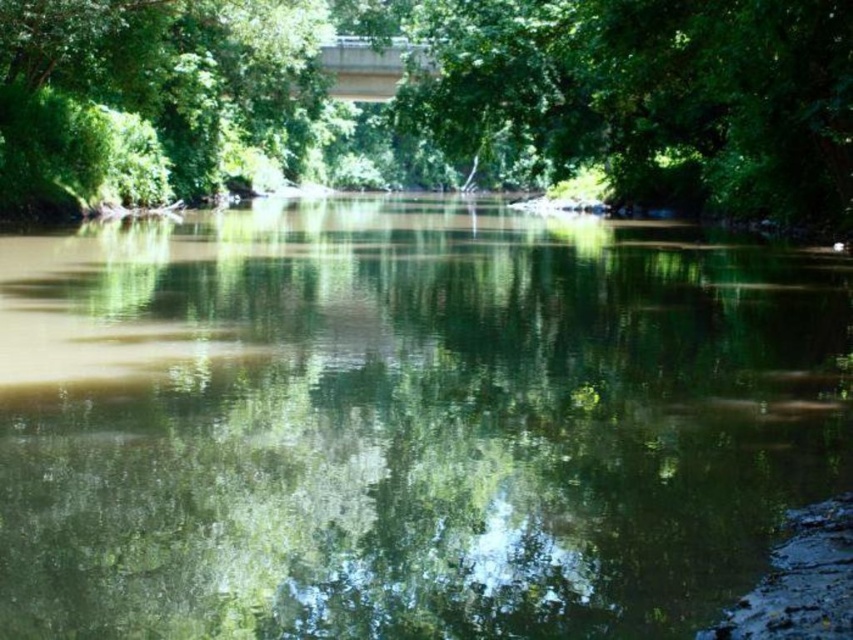
You are standing on the riverbank and want to cross the river using a small wooden plank. The plank is exactly as wide as the green leafy tree at center. Will the plank be wide enough to safely cross the green reflective water at center?

The green reflective water at center has a lesser width compared to green leafy tree at center. Since the plank is as wide as the tree, it will be wider than the water, so the plank will be wide enough to safely cross the green reflective water at center.

You are a hiker planning to cross the river using the concrete bridge at upper center. You notice a green leafy tree at upper center nearby. Which object is bigger in size?

The green leafy tree at upper center is larger in size compared to the concrete bridge at upper center.

In the scene shown: You are a photographer standing at the edge of the river. You want to take a photo of the green leafy tree at upper center. If your camera has a maximum zoom range of 150 feet, will you be able to capture the tree clearly without moving closer?

The green leafy tree at upper center is 149.75 feet from the camera. Since the camera can zoom up to 150 feet, it is just within range. Therefore, you can capture the tree clearly without moving closer.